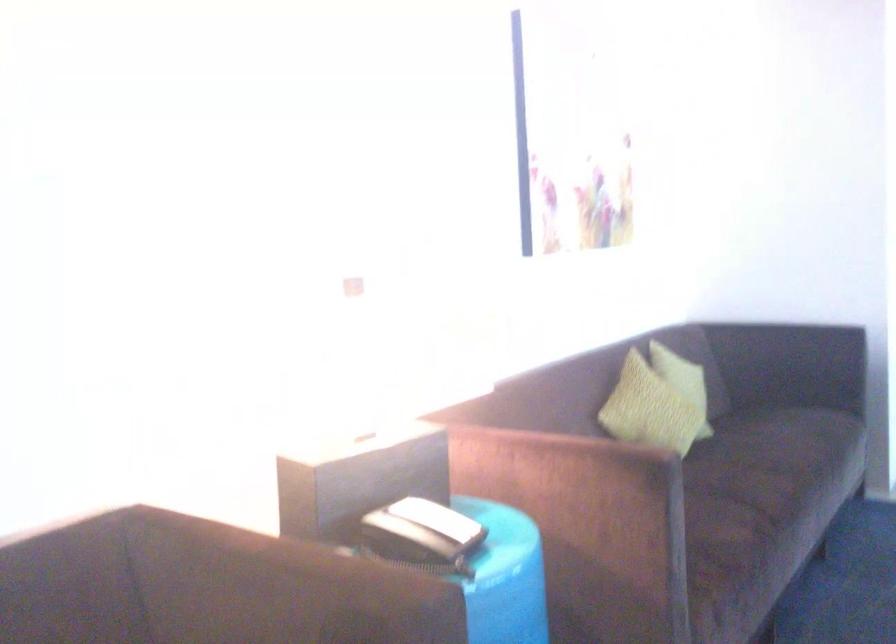
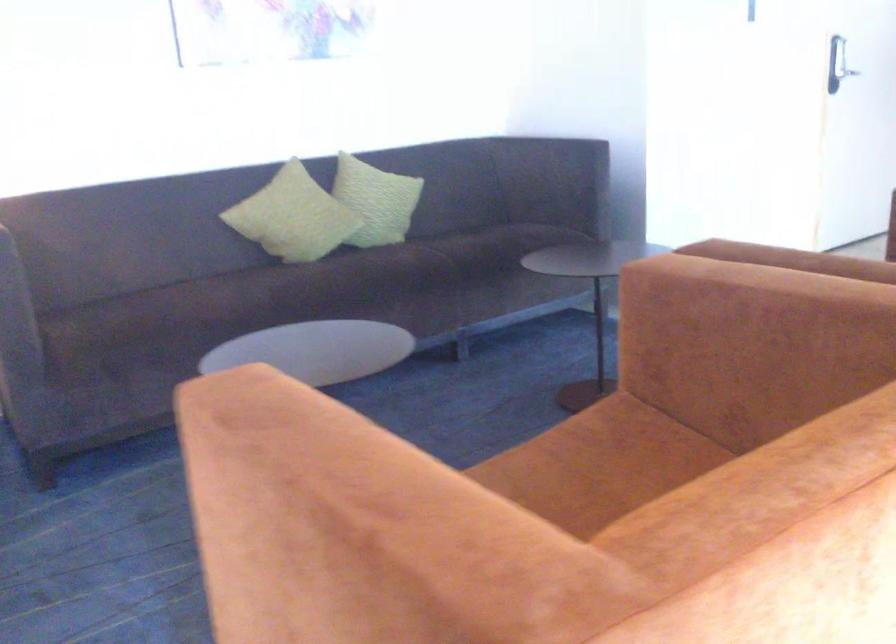
In the second image, find the point that corresponds to point (690, 399) in the first image.

(293, 216)